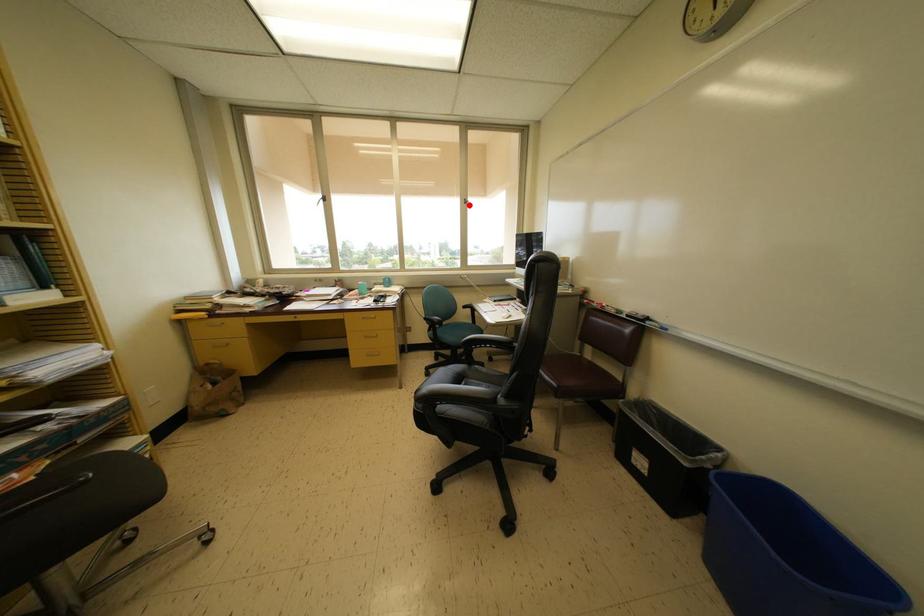
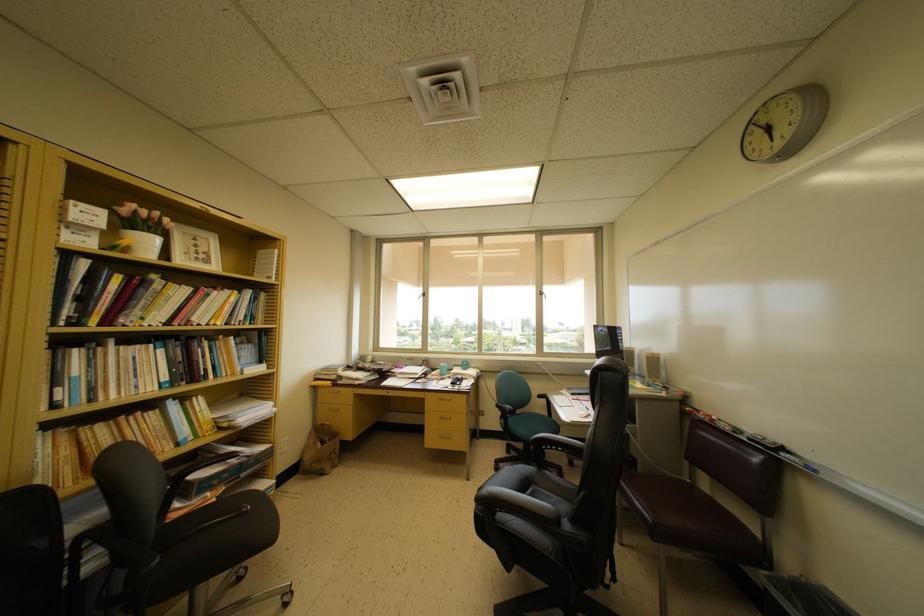
The point at the highlighted location is marked in the first image. Where is the corresponding point in the second image?

(543, 297)